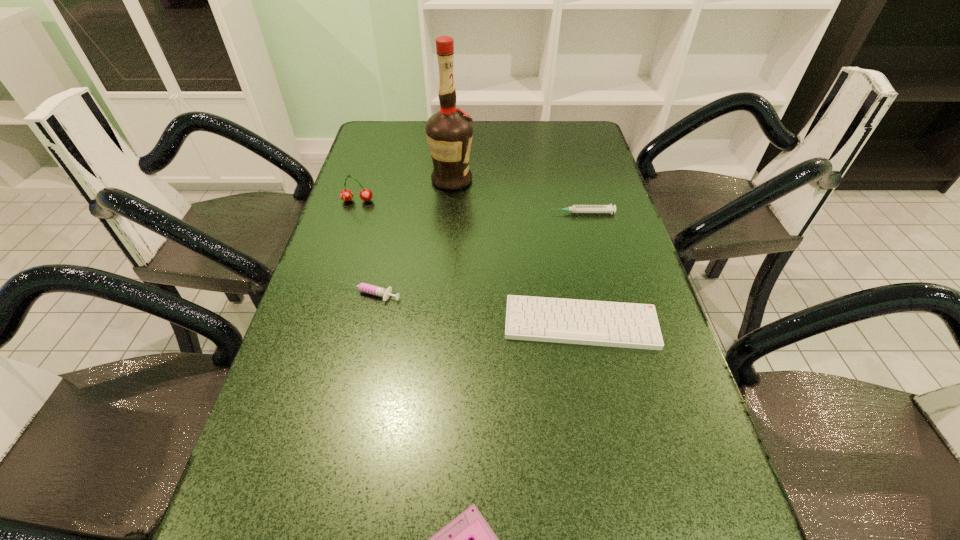
Find the location of `free space at the left edge of the desktop`. free space at the left edge of the desktop is located at coordinates (379, 259).

Identify the location of blank area at the right edge. Image resolution: width=960 pixels, height=540 pixels. (579, 215).

This screenshot has height=540, width=960. I want to click on vacant space at the far left corner of the desktop, so click(411, 143).

Locate an element on the screen. The width and height of the screenshot is (960, 540). empty location between the farthest object and the nearer syringe is located at coordinates (410, 237).

Where is `free space between the cherry and the liquor`? free space between the cherry and the liquor is located at coordinates (405, 191).

Locate an element on the screen. This screenshot has width=960, height=540. free space between the fifth nearest object and the liquor is located at coordinates (405, 191).

Where is `vacant area that lies between the second tallest object and the computer keyboard`? The height and width of the screenshot is (540, 960). vacant area that lies between the second tallest object and the computer keyboard is located at coordinates (469, 262).

Find the location of `vacant area that lies between the nearer syringe and the right syringe`. vacant area that lies between the nearer syringe and the right syringe is located at coordinates (475, 253).

At what (x,y) coordinates should I click in order to perform the action: click on the third closest object to the nearer syringe. Please return your answer as a coordinate pair (x, y). The height and width of the screenshot is (540, 960). Looking at the image, I should click on (449, 132).

Find the location of a particular element. This screenshot has width=960, height=540. object that can be found as the fourth closest to the liquor is located at coordinates (615, 324).